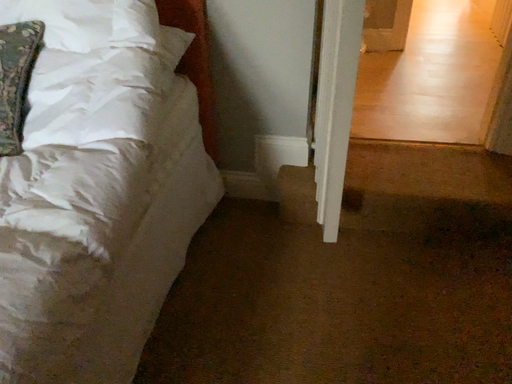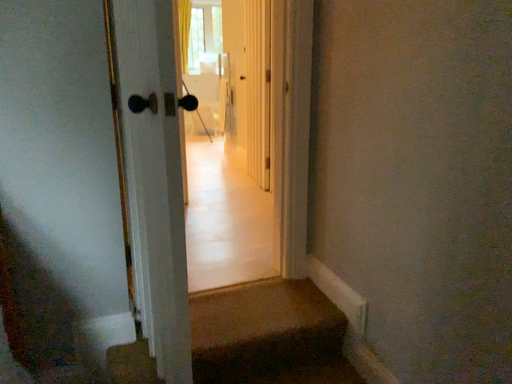
Question: Which way did the camera rotate in the video?

Choices:
 (A) rotated downward
 (B) rotated upward

Answer: (B)